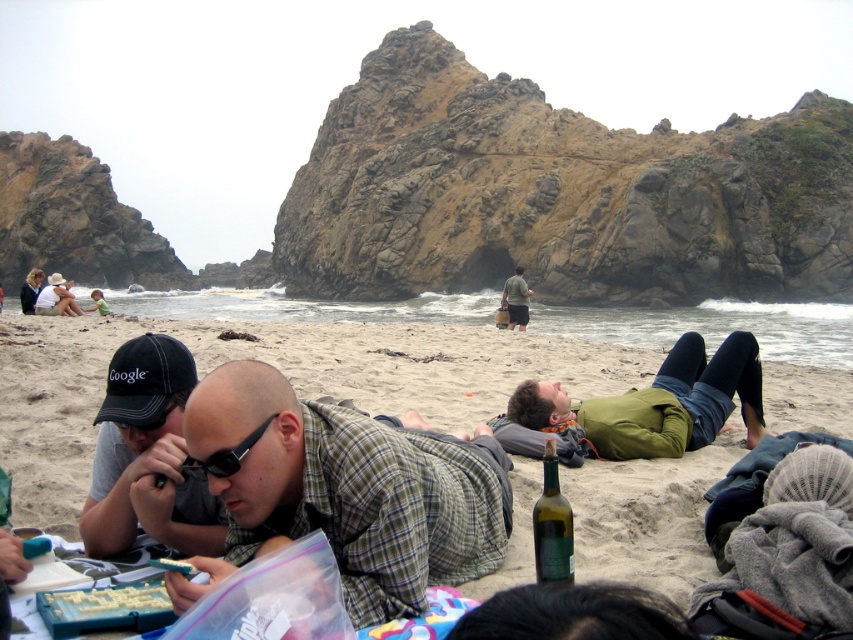
Question: Is brown rocky cliff at center to the left of plaid fabric shirt at center from the viewer's perspective?

Choices:
 (A) no
 (B) yes

Answer: (A)

Question: Which of these objects is positioned farthest from the matte black jacket at upper left?

Choices:
 (A) green glass bottle at center
 (B) dark gray fabric cap at lower left
 (C) matte black cap at upper left

Answer: (A)

Question: Does green glass bottle at center appear under green fabric shirt at center?

Choices:
 (A) yes
 (B) no

Answer: (A)

Question: Among these points, which one is nearest to the camera?

Choices:
 (A) (512, 328)
 (B) (183, 364)

Answer: (B)

Question: Is green glass bottle at center positioned before black plastic sunglasses at center?

Choices:
 (A) yes
 (B) no

Answer: (A)

Question: Which of the following is the closest to the observer?

Choices:
 (A) green matte jacket at center
 (B) black plastic sunglasses at center
 (C) black denim baseball cap at lower left

Answer: (B)